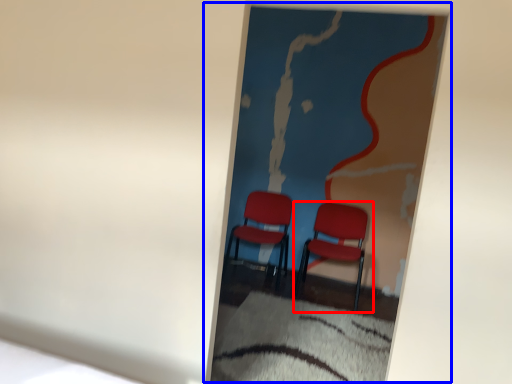
Question: Which of the following is the closest to the observer, chair (highlighted by a red box) or picture frame (highlighted by a blue box)?

Choices:
 (A) chair
 (B) picture frame

Answer: (B)